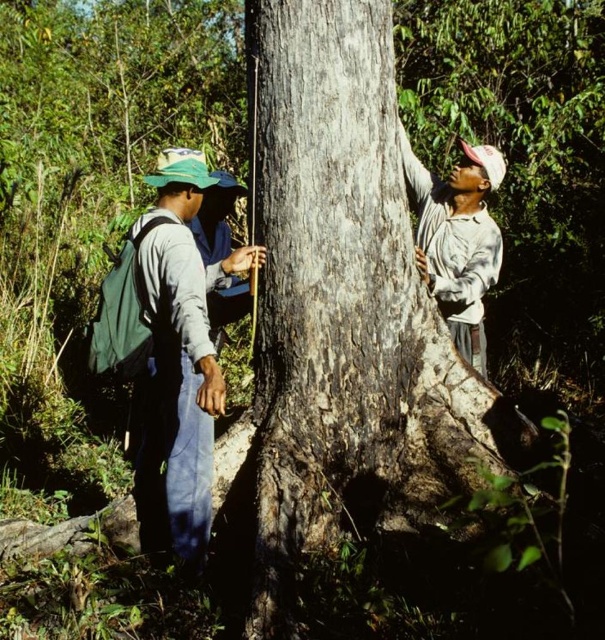
Which of these two, dark brown rough bark at center or green fabric shirt at center, stands shorter?

Standing shorter between the two is green fabric shirt at center.

Is dark brown rough bark at center smaller than green fabric shirt at center?

Incorrect, dark brown rough bark at center is not smaller in size than green fabric shirt at center.

The image size is (605, 640). What do you see at coordinates (345, 310) in the screenshot?
I see `dark brown rough bark at center` at bounding box center [345, 310].

This screenshot has height=640, width=605. I want to click on dark brown rough bark at center, so click(x=345, y=310).

Who is taller, dark brown rough bark at center or white matte shirt at upper right?

Standing taller between the two is dark brown rough bark at center.

Does dark brown rough bark at center have a smaller size compared to white matte shirt at upper right?

No.

Is point (289, 413) closer to camera compared to point (459, 348)?

Yes, point (289, 413) is closer to viewer.

The width and height of the screenshot is (605, 640). In order to click on dark brown rough bark at center in this screenshot , I will do `click(345, 310)`.

Is point (416, 243) in front of point (244, 301)?

Yes, point (416, 243) is closer to viewer.

Consider the image. Does white matte shirt at upper right have a smaller size compared to green fabric shirt at center?

Incorrect, white matte shirt at upper right is not smaller in size than green fabric shirt at center.

Who is more distant from viewer, (459, 348) or (242, 296)?

The point (242, 296) is behind.

I want to click on white matte shirt at upper right, so click(457, 240).